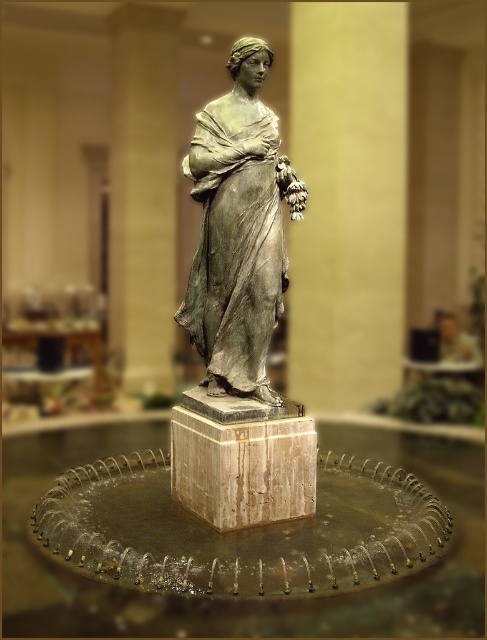
You are an art conservator assessing the stability of the green patina bronze statue at center. Given that the statue is thinner than the marble pedestal at center, what might be a concern regarding its placement?

The green patina bronze statue at center is thinner than the marble pedestal at center, which could mean it might not be securely anchored, posing a stability risk.